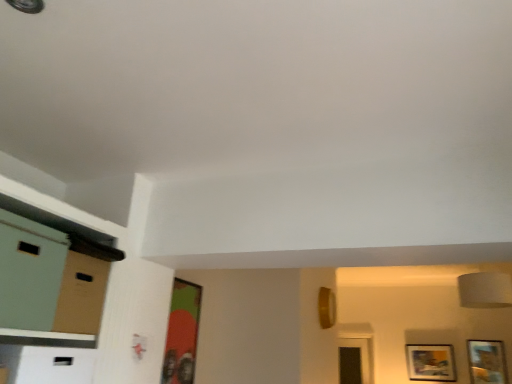
Question: Which direction should I rotate to look at green matte picture frame at center, acting as the first picture frame starting from the front, — up or down?

Choices:
 (A) up
 (B) down

Answer: (B)

Question: Could wooden picture frame at lower right, placed as the 2th picture frame when sorted from left to right, be considered to be inside matte cardboard dresser at left?

Choices:
 (A) yes
 (B) no

Answer: (B)

Question: Is matte cardboard dresser at left smaller than wooden picture frame at lower right, which is counted as the 3th picture frame, starting from the front?

Choices:
 (A) yes
 (B) no

Answer: (B)

Question: Does matte cardboard dresser at left have a greater height compared to wooden picture frame at lower right, the second picture frame positioned from the right?

Choices:
 (A) yes
 (B) no

Answer: (B)

Question: From the image's perspective, is matte cardboard dresser at left on top of wooden picture frame at lower right, which appears as the third picture frame when viewed from the top?

Choices:
 (A) no
 (B) yes

Answer: (B)

Question: From a real-world perspective, is matte cardboard dresser at left located beneath wooden picture frame at lower right, the second picture frame positioned from the right?

Choices:
 (A) yes
 (B) no

Answer: (B)

Question: Could you tell me if matte cardboard dresser at left is facing wooden picture frame at lower right, the first picture frame in the back-to-front sequence?

Choices:
 (A) yes
 (B) no

Answer: (B)

Question: Does matte green file cabinet at left have a greater width compared to wooden picture frame at lower right, which appears as the third picture frame when viewed from the top?

Choices:
 (A) yes
 (B) no

Answer: (A)

Question: Is matte green file cabinet at left further to the viewer compared to wooden picture frame at lower right, the second picture frame positioned from the right?

Choices:
 (A) no
 (B) yes

Answer: (A)

Question: Can you confirm if matte green file cabinet at left is thinner than wooden picture frame at lower right, placed as the 2th picture frame when sorted from left to right?

Choices:
 (A) no
 (B) yes

Answer: (A)

Question: Does matte green file cabinet at left have a smaller size compared to wooden picture frame at lower right, which is counted as the 3th picture frame, starting from the front?

Choices:
 (A) yes
 (B) no

Answer: (B)

Question: Can you confirm if matte green file cabinet at left is shorter than wooden picture frame at lower right, which appears as the third picture frame when viewed from the top?

Choices:
 (A) no
 (B) yes

Answer: (B)

Question: From the image's perspective, is matte green file cabinet at left on top of wooden picture frame at lower right, arranged as the 1th picture frame when ordered from the bottom?

Choices:
 (A) no
 (B) yes

Answer: (B)

Question: Would you say matte green file cabinet at left is outside wooden framed picture at lower right, arranged as the 2th picture frame when viewed from the front?

Choices:
 (A) yes
 (B) no

Answer: (A)